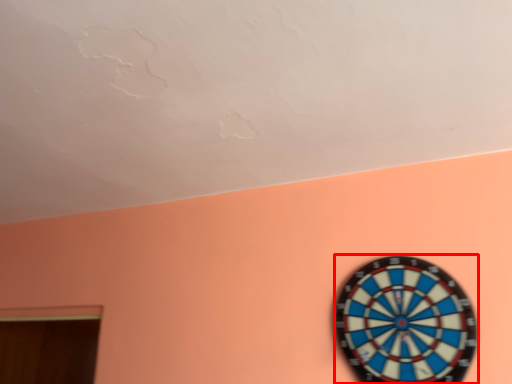
Question: From the image's perspective, considering the relative positions of clock (annotated by the red box) and window in the image provided, where is clock (annotated by the red box) located with respect to the staircase?

Choices:
 (A) above
 (B) below

Answer: (A)